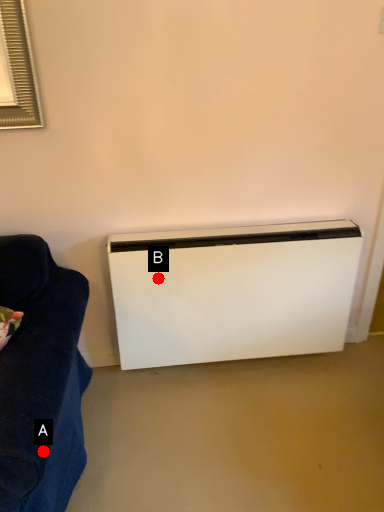
Question: Two points are circled on the image, labeled by A and B beside each circle. Which point is farther from the camera taking this photo?

Choices:
 (A) A is further
 (B) B is further

Answer: (B)